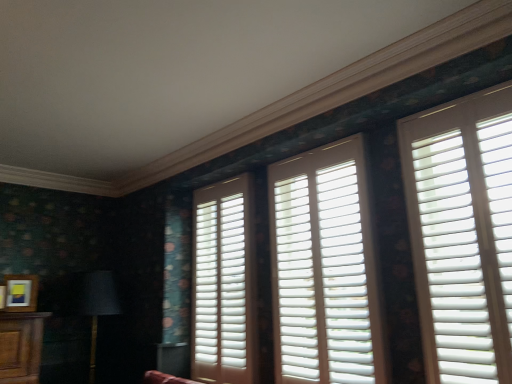
Question: Choose the correct answer: Is white matte shutters at right, acting as the first window starting from the right, inside matte wooden picture frame at lower left or outside it?

Choices:
 (A) inside
 (B) outside

Answer: (B)

Question: From the image's perspective, relative to matte wooden picture frame at lower left, is white matte shutters at right, acting as the first window starting from the right, above or below?

Choices:
 (A) above
 (B) below

Answer: (A)

Question: Which is nearer to the matte wooden picture frame at lower left?

Choices:
 (A) white matte shutters at right, acting as the first window starting from the right
 (B) white wood blinds at center, the 3th window when ordered from right to left
 (C) white matte wood shutters at center, acting as the 2th window starting from the right
 (D) matte black lampshade at left

Answer: (D)

Question: Which object is positioned farthest from the matte wooden picture frame at lower left?

Choices:
 (A) matte black lampshade at left
 (B) white wood blinds at center, arranged as the first window when viewed from the left
 (C) white matte wood shutters at center, acting as the 2th window starting from the right
 (D) white matte shutters at right, acting as the first window starting from the right

Answer: (D)